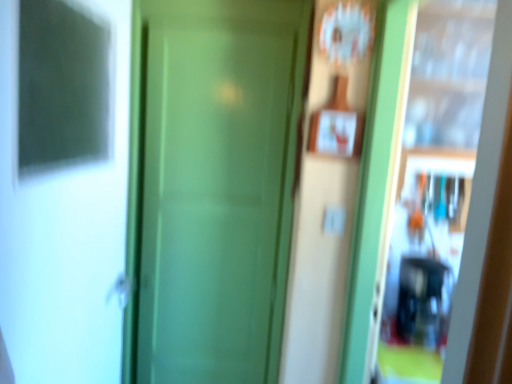
Question: Considering their positions, is white glossy screen door at left, positioned as the 2th screen door in right-to-left order, located in front of or behind green matte door at center?

Choices:
 (A) behind
 (B) front

Answer: (B)

Question: Is white glossy screen door at left, positioned as the 2th screen door in right-to-left order, wider or thinner than green matte door at center?

Choices:
 (A) wide
 (B) thin

Answer: (A)

Question: Considering the real-world distances, which object is farthest from the green matte screen door at center, positioned as the 1th screen door in right-to-left order?

Choices:
 (A) green matte door at center
 (B) white glossy screen door at left, positioned as the 2th screen door in right-to-left order

Answer: (B)

Question: Which object is positioned closest to the green matte screen door at center, positioned as the 1th screen door in right-to-left order?

Choices:
 (A) green matte door at center
 (B) white glossy screen door at left, positioned as the 2th screen door in right-to-left order

Answer: (A)